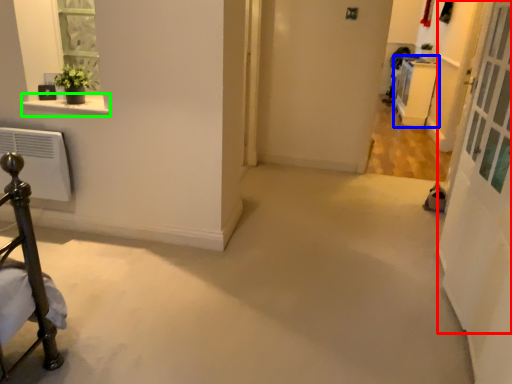
Question: Estimate the real-world distances between objects in this image. Which object is farther from screen door (highlighted by a red box), furniture (highlighted by a blue box) or window sill (highlighted by a green box)?

Choices:
 (A) furniture
 (B) window sill

Answer: (A)